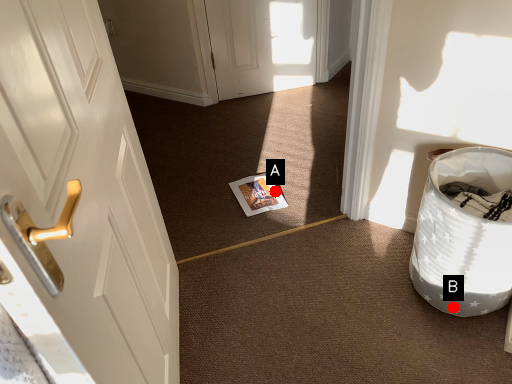
Question: Two points are circled on the image, labeled by A and B beside each circle. Which point is closer to the camera?

Choices:
 (A) A is closer
 (B) B is closer

Answer: (B)